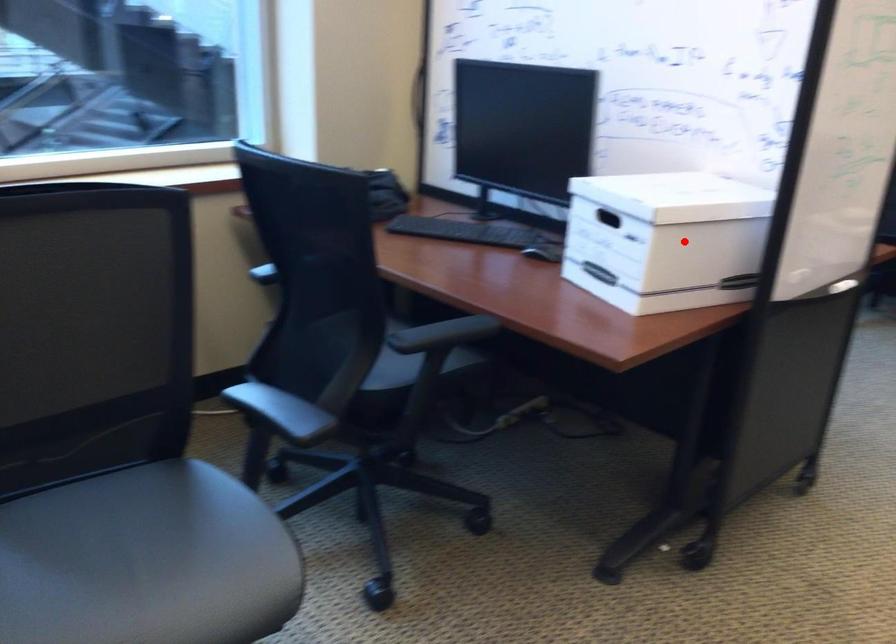
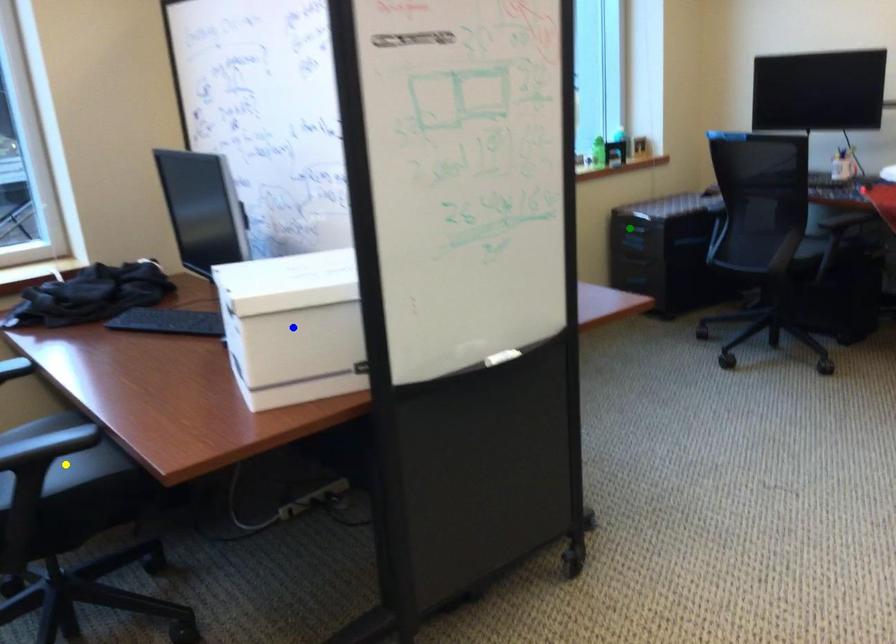
Question: I am providing you with two images of the same scene from different viewpoints. A red point is marked on the first image. You are given multiple points on the second image. In image 2, which mark is for the same physical point as the one in image 1?

Choices:
 (A) yellow point
 (B) blue point
 (C) green point

Answer: (B)